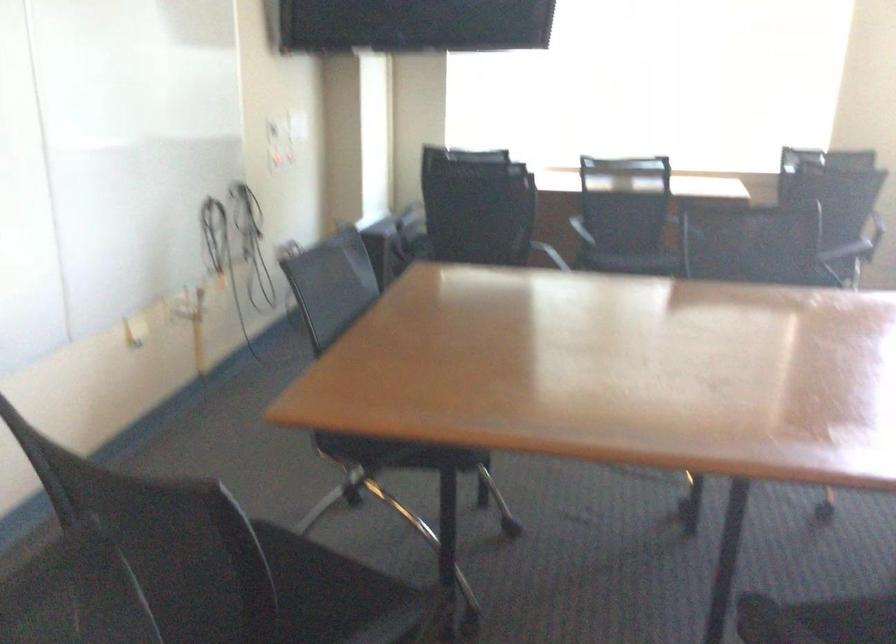
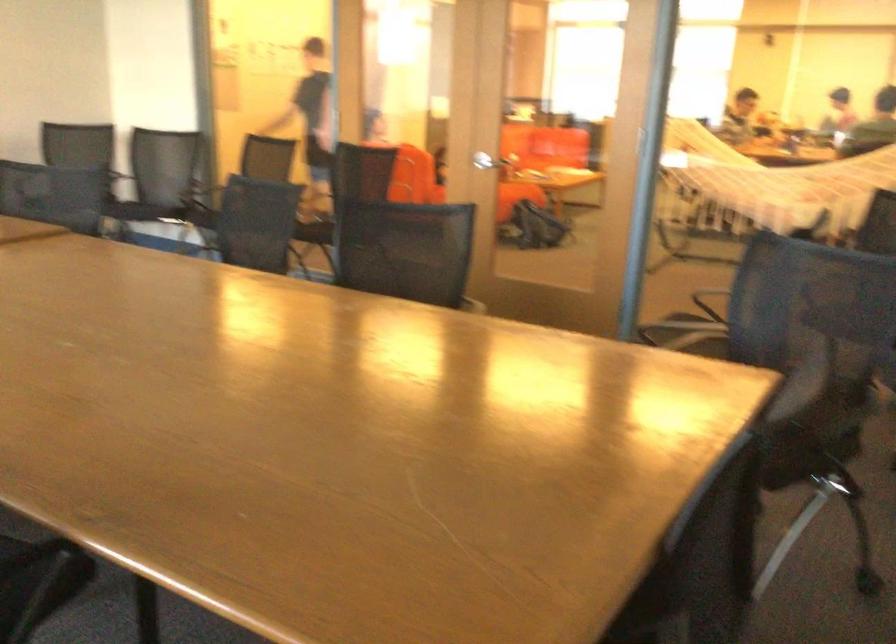
Question: I am providing you with two images of the same scene from different viewpoints. Please identify which objects are invisible in image2.

Choices:
 (A) sofa sitting surface
 (B) chair sitting surface
 (C) orange plastic scoop
 (D) silver door handle

Answer: (B)